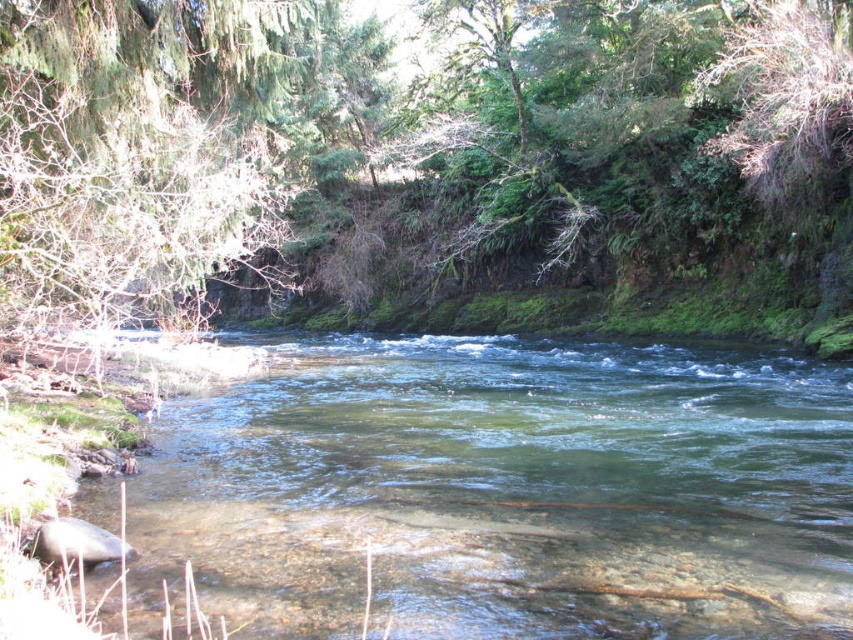
Does green mossy tree at center have a larger size compared to clear water at center?

Indeed, green mossy tree at center has a larger size compared to clear water at center.

Is point (503, 74) closer to camera compared to point (851, 500)?

No, it is behind (851, 500).

You are a GUI agent. You are given a task and a screenshot of the screen. Output one action in this format:
    pyautogui.click(x=<x>, y=<y>)
    Task: Click on the green mossy tree at center
    
    Given the screenshot: What is the action you would take?
    pyautogui.click(x=431, y=164)